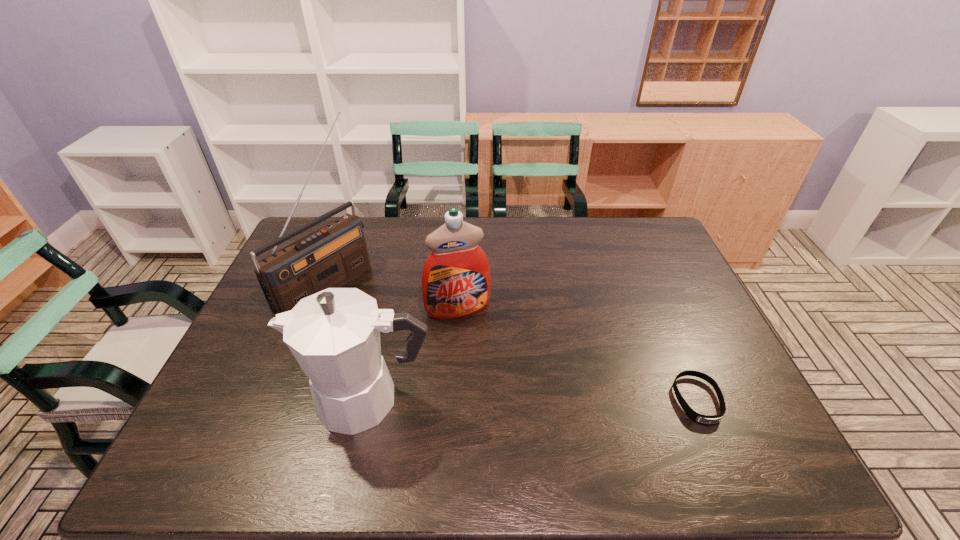
Locate an element on the screen. vacant space on the desktop that is between the coffeepot and the shortest object and is positioned on the front-facing side of the tallest object is located at coordinates (504, 400).

Identify the location of vacant spot on the desktop that is between the coffeepot and the wristband and is positioned on the front surface of the detergent. This screenshot has height=540, width=960. (489, 400).